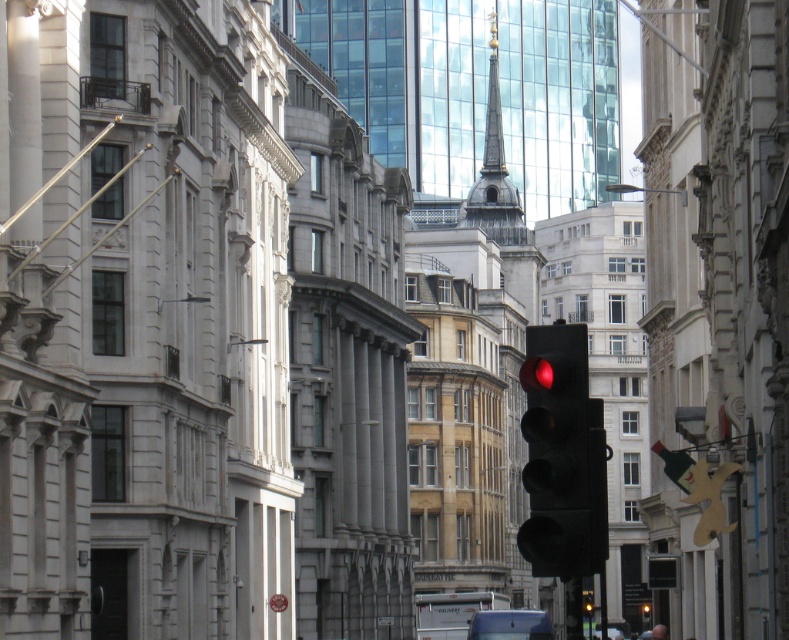
Consider the image. You are a pedestrian standing at the crosswalk and want to know if the black matte traffic light at center is taller than the blue metallic van at lower center. Can you confirm this?

The black matte traffic light at center is taller than the blue metallic van at lower center, so yes, the traffic light is indeed taller than the van.

You are a pedestrian crossing the street and see the blue metallic van at lower center and the metallic silver car at lower right. Which vehicle takes up more space on the road?

The metallic silver car at lower right takes up more space on the road than the blue metallic van at lower center because the blue metallic van at lower center occupies less space than metallic silver car at lower right.

You are a delivery driver approaching the traffic light at the intersection. You see the blue metallic van at lower center. Based on its position, can you estimate whether it is positioned to turn left, go straight, or turn right?

The blue metallic van at lower center is located at point coordinates that typically indicate a position in the center lane. Since the traffic light is red, the van must stop. However, without specific lane markings or additional context about the road layout, it is not possible to definitively determine if the van intends to turn left, go straight, or turn right based solely on its current position.